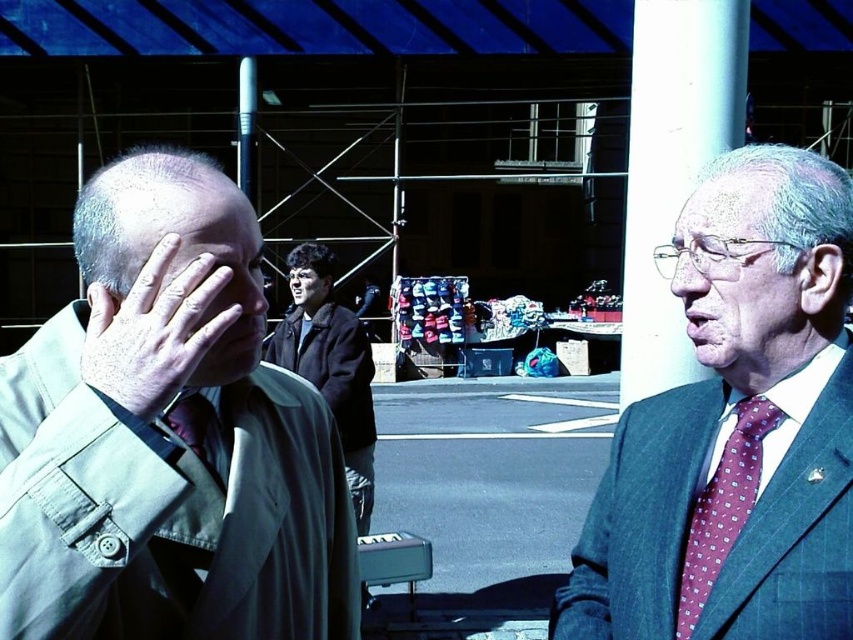
Question: Estimate the real-world distances between objects in this image. Which object is farther from the blue plaid suit at right?

Choices:
 (A) smooth beige hand at center left
 (B) khaki fabric jacket at left

Answer: (A)

Question: Is dry skin hand at left behind maroon dotted tie at right?

Choices:
 (A) no
 (B) yes

Answer: (A)

Question: Considering the relative positions of smooth beige hand at center left and matte black nose at center in the image provided, where is smooth beige hand at center left located with respect to matte black nose at center?

Choices:
 (A) right
 (B) left

Answer: (A)

Question: Considering the real-world distances, which object is closest to the dark wool coat at center?

Choices:
 (A) maroon dotted tie at right
 (B) blue plaid suit at right
 (C) matte black nose at center

Answer: (C)

Question: Does khaki fabric jacket at left appear on the right side of maroon dotted tie at right?

Choices:
 (A) yes
 (B) no

Answer: (B)

Question: Which object is positioned closest to the dark wool coat at center?

Choices:
 (A) matte black nose at center
 (B) pink fabric nose at right
 (C) smooth beige hand at center left
 (D) smooth skin face at center

Answer: (D)